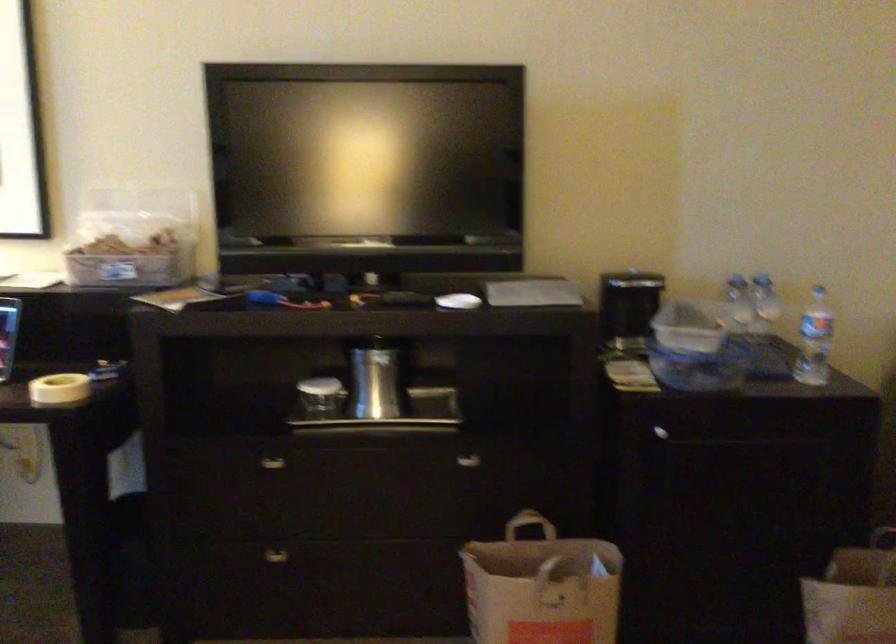
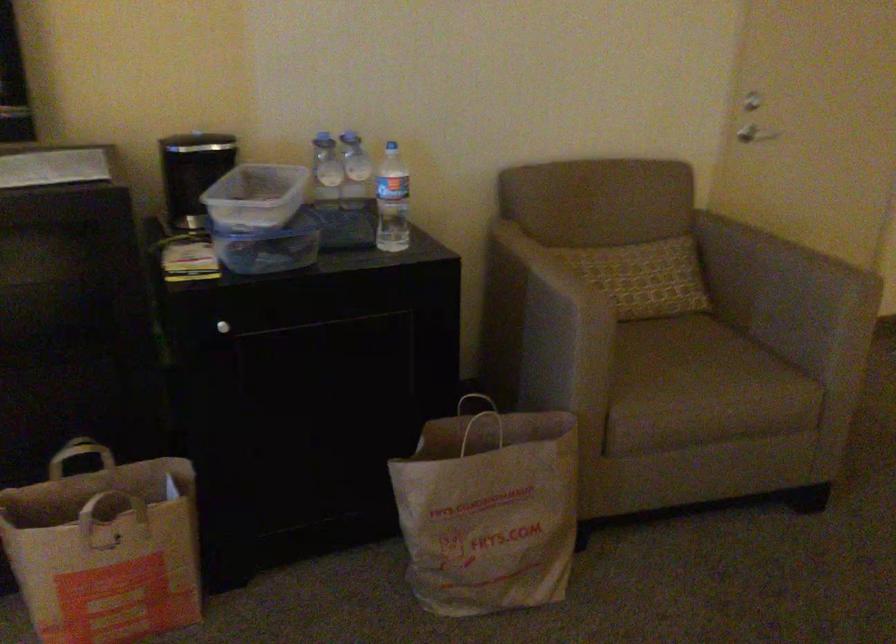
In the second image, find the point that corresponds to [744,301] in the first image.

(325, 169)